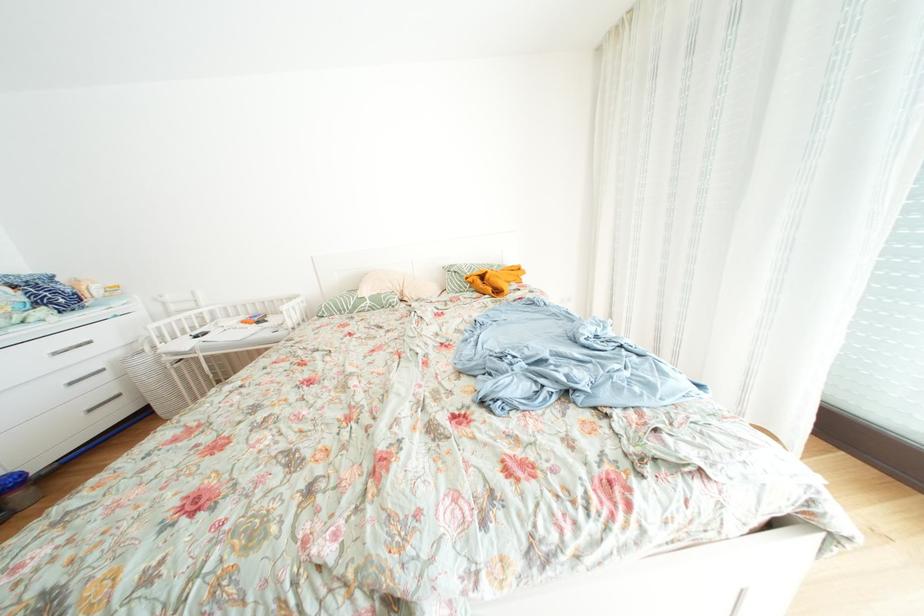
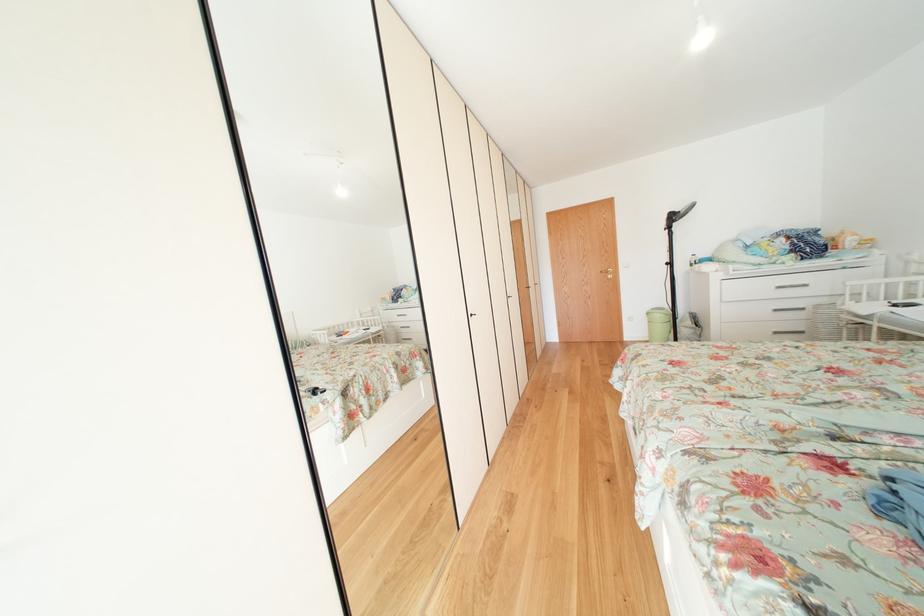
The point at [100,416] is marked in the first image. Where is the corresponding point in the second image?

(784, 338)